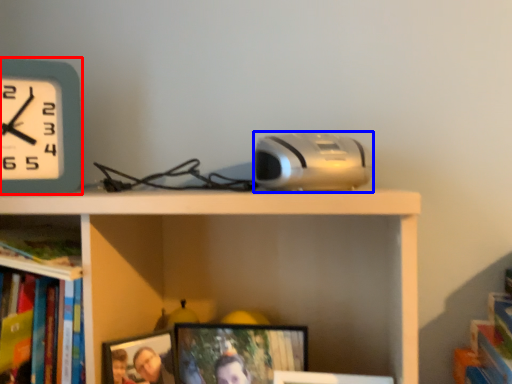
Question: Which of the following is the farthest to the observer, wall clock (highlighted by a red box) or gadget (highlighted by a blue box)?

Choices:
 (A) wall clock
 (B) gadget

Answer: (A)